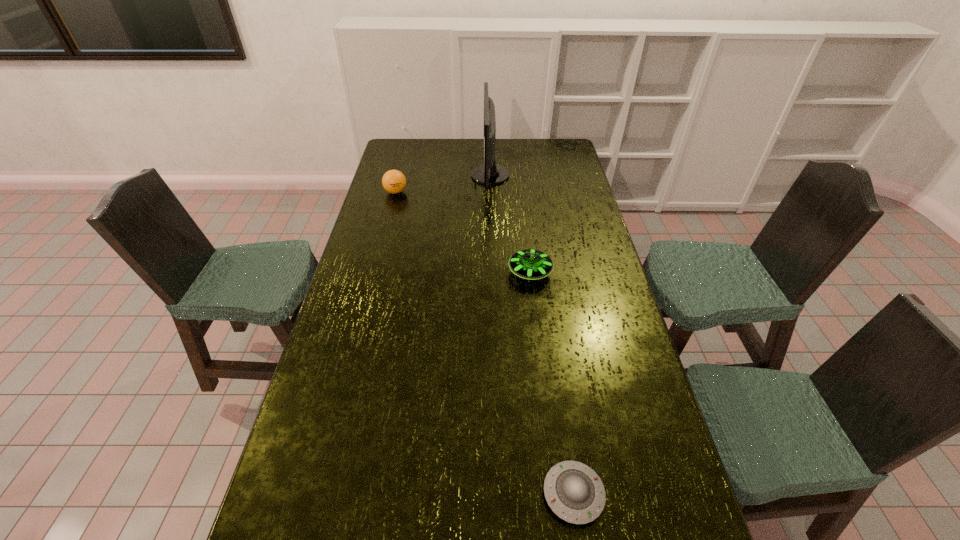
Locate an element on the screen. The image size is (960, 540). vacant space located on the side with brand of the ping-pong ball is located at coordinates (387, 225).

Locate an element on the screen. The width and height of the screenshot is (960, 540). free point located on the front of the second nearest object is located at coordinates (544, 390).

Locate an element on the screen. vacant space located 0.250m on the back of the nearest object is located at coordinates (556, 376).

You are a GUI agent. You are given a task and a screenshot of the screen. Output one action in this format:
    pyautogui.click(x=<x>, y=<y>)
    Task: Click on the object present at the far edge
    The height and width of the screenshot is (540, 960).
    Given the screenshot: What is the action you would take?
    pyautogui.click(x=489, y=173)

Locate an element on the screen. This screenshot has height=540, width=960. object that is at the left edge is located at coordinates point(393,181).

In the image, there is a desktop. Identify the location of vacant space at the far edge. The height and width of the screenshot is (540, 960). (461, 145).

At what (x,y) coordinates should I click in order to perform the action: click on blank space at the left edge of the desktop. Please return your answer as a coordinate pair (x, y). Image resolution: width=960 pixels, height=540 pixels. Looking at the image, I should click on (355, 248).

In the image, there is a desktop. Identify the location of blank space at the right edge. (586, 285).

Locate an element on the screen. vacant space at the far left corner of the desktop is located at coordinates (413, 159).

In order to click on free space between the tallest object and the nearer saucer in this screenshot , I will do `click(532, 335)`.